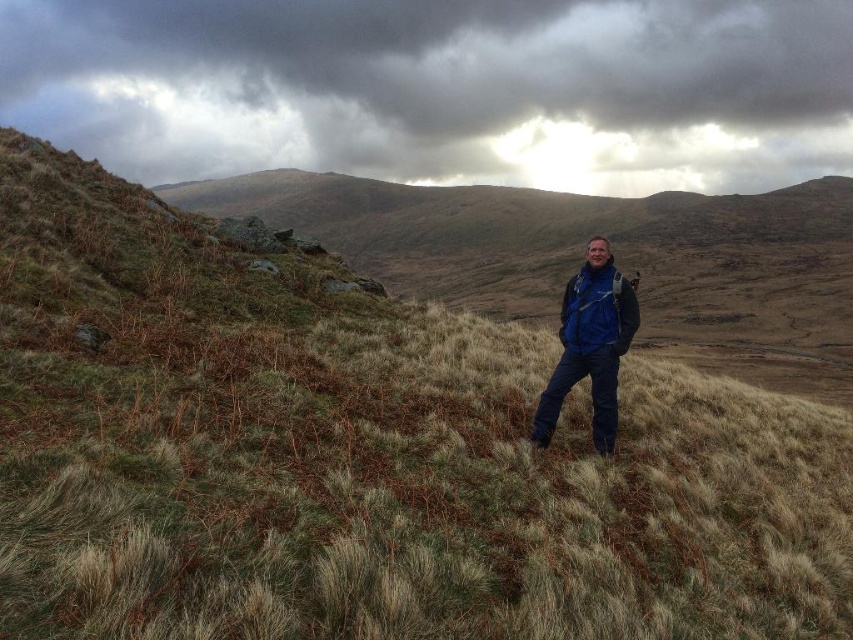
You are standing at the center of the landscape and see both the blue fabric jacket at center and the blue fleece jacket at center. Which one is positioned more to the left?

The blue fabric jacket at center is positioned to the left of the blue fleece jacket at center.

You are a hiker lost in the rugged landscape and you see the dark cloudy sky at upper center and the blue fleece jacket at center. Which object is positioned to the left of the other?

The dark cloudy sky at upper center is to the left of the blue fleece jacket at center.